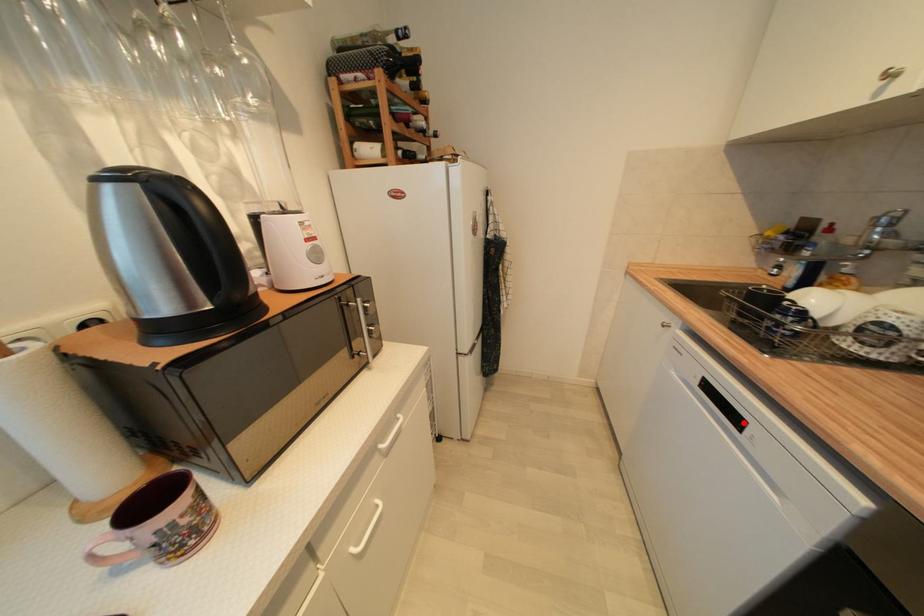
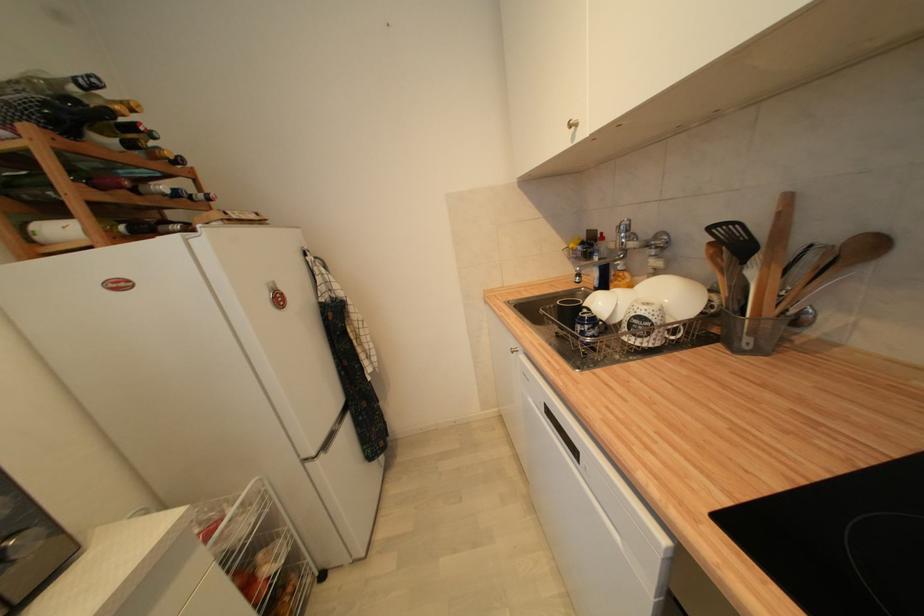
Find the pixel in the second image that matches the highlighted location in the first image.

(578, 453)